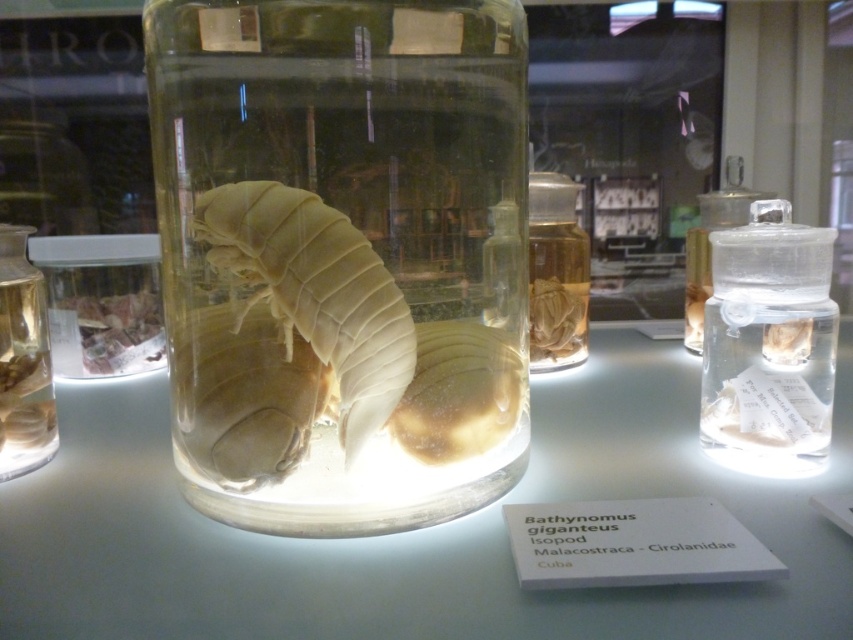
Is point (218, 534) more distant than point (689, 236)?

No, (218, 534) is in front of (689, 236).

What are the coordinates of `transparent glass table at center` in the screenshot? It's located at coord(412,531).

At what (x,y) coordinates should I click in order to perform the action: click on transparent glass table at center. Please return your answer as a coordinate pair (x, y). Looking at the image, I should click on (412, 531).

Based on the photo, can you confirm if transparent glass jar at center is thinner than transparent plastic bottle at upper right?

No, transparent glass jar at center is not thinner than transparent plastic bottle at upper right.

Can you confirm if transparent glass jar at center is positioned to the left of transparent plastic bottle at upper right?

Yes, transparent glass jar at center is to the left of transparent plastic bottle at upper right.

Does point (445, 483) come in front of point (691, 326)?

Yes.

The image size is (853, 640). Find the location of `transparent glass jar at center`. transparent glass jar at center is located at coordinates (341, 257).

From the picture: Is clear glass jar at right shorter than translucent white isopod at center?

No.

Is point (778, 296) in front of point (212, 248)?

No, (778, 296) is behind (212, 248).

Who is more distant from viewer, (756, 324) or (312, 272)?

Point (756, 324)

Where is `clear glass jar at right`? clear glass jar at right is located at coordinates (769, 344).